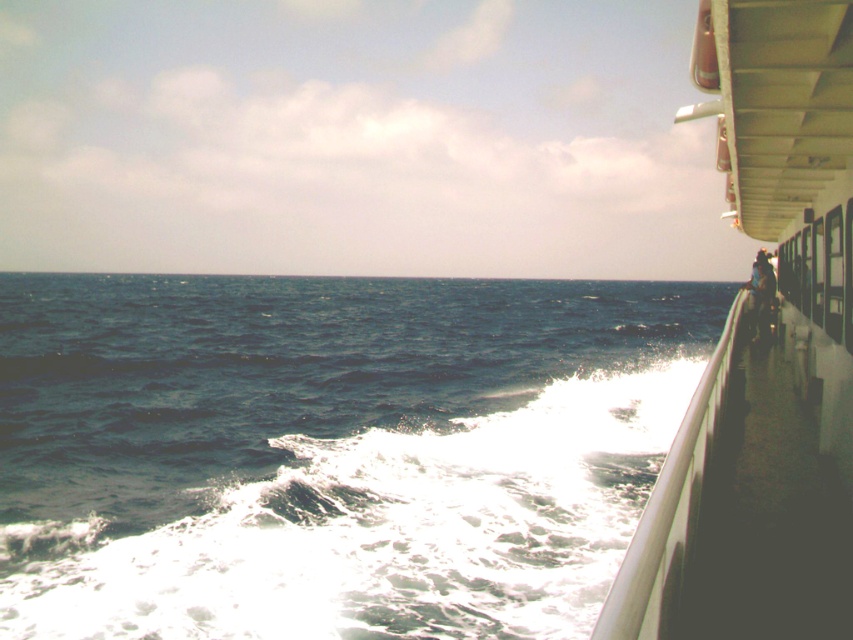
Question: Can you confirm if blue water at lower left is bigger than brown leather jacket at right?

Choices:
 (A) no
 (B) yes

Answer: (B)

Question: Which object is closer to the camera taking this photo?

Choices:
 (A) blue water at lower left
 (B) brown leather jacket at right
 (C) white glossy boat at right

Answer: (C)

Question: Which point is closer to the camera taking this photo?

Choices:
 (A) (x=753, y=257)
 (B) (x=793, y=186)
 (C) (x=285, y=449)

Answer: (B)

Question: Among these points, which one is nearest to the camera?

Choices:
 (A) (773, 134)
 (B) (291, 336)
 (C) (751, 307)

Answer: (A)

Question: Is white glossy boat at right above brown leather jacket at right?

Choices:
 (A) no
 (B) yes

Answer: (B)

Question: Can you confirm if blue water at lower left is smaller than brown leather jacket at right?

Choices:
 (A) yes
 (B) no

Answer: (B)